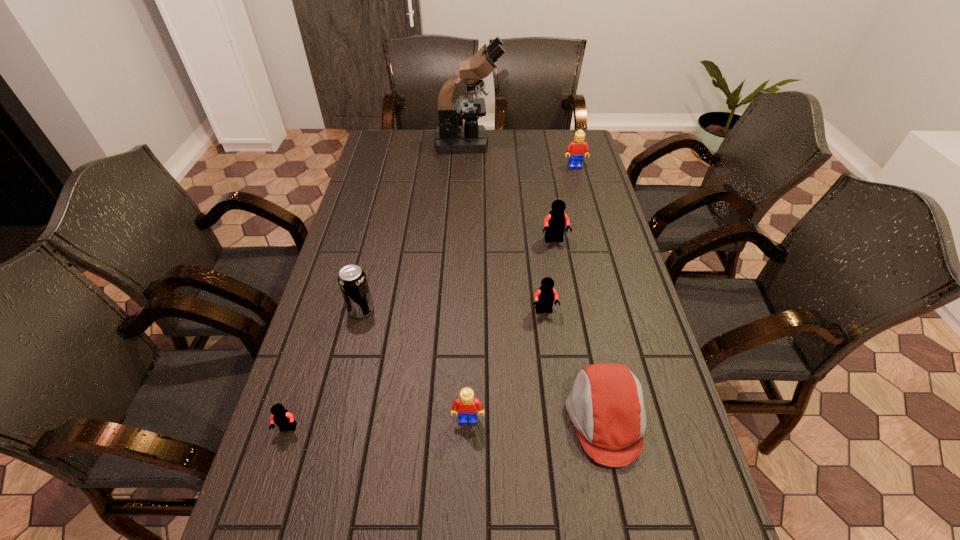
At what (x,y) coordinates should I click in order to perform the action: click on the nearer yellow Lego. Please return your answer as a coordinate pair (x, y). This screenshot has height=540, width=960. Looking at the image, I should click on (466, 405).

At what (x,y) coordinates should I click in order to perform the action: click on cap. Please return your answer as a coordinate pair (x, y). This screenshot has height=540, width=960. Looking at the image, I should click on (606, 406).

What are the coordinates of `the shortest object` in the screenshot? It's located at (280, 416).

Where is `the nearest black Lego`? the nearest black Lego is located at coordinates (280, 416).

The image size is (960, 540). I want to click on free space located 0.050m on the left of the microscope, so click(x=423, y=143).

The width and height of the screenshot is (960, 540). Find the location of `vacant space situated on the front-facing side of the bigger yellow Lego`. vacant space situated on the front-facing side of the bigger yellow Lego is located at coordinates (592, 232).

The image size is (960, 540). Identify the location of free spot located 0.100m on the front-facing side of the farthest black Lego. (560, 269).

This screenshot has width=960, height=540. Find the location of `free region located 0.070m on the back of the soda can`. free region located 0.070m on the back of the soda can is located at coordinates (368, 282).

I want to click on vacant space located 0.390m on the front-facing side of the second smallest black Lego, so click(x=564, y=462).

This screenshot has width=960, height=540. Find the location of `free space located 0.180m on the front-facing side of the fourth Lego from right to left`. free space located 0.180m on the front-facing side of the fourth Lego from right to left is located at coordinates (467, 512).